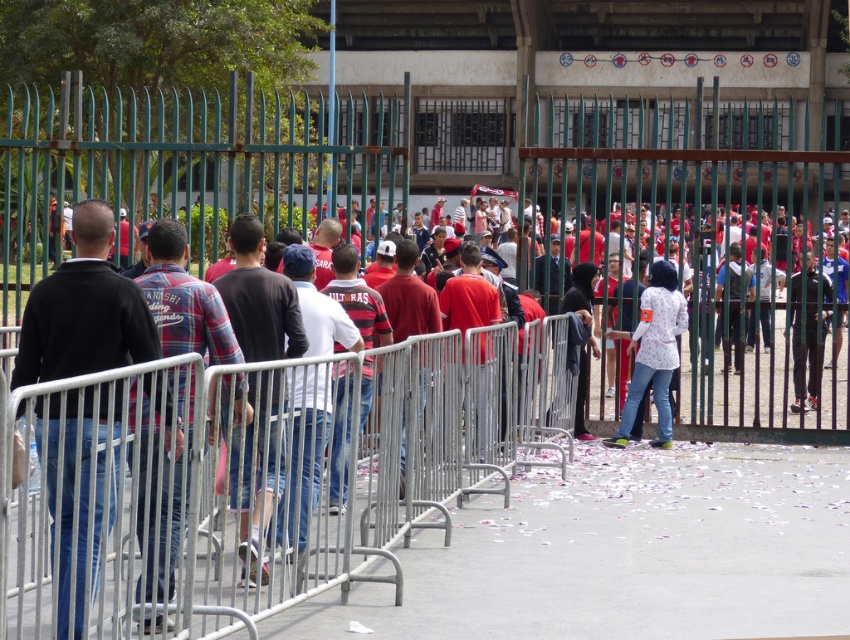
Does silver metallic rail at center have a greater width compared to black sweater at left?

Yes.

Between silver metallic rail at center and black sweater at left, which one is positioned higher?

black sweater at left is above.

Does point (217, 461) lie behind point (88, 204)?

Yes, point (217, 461) is farther from viewer.

Where is `silver metallic rail at center`? silver metallic rail at center is located at coordinates (344, 472).

Who is positioned more to the left, matte black jacket at center or white matte shirt at center?

From the viewer's perspective, matte black jacket at center appears more on the left side.

Does matte black jacket at center lie in front of white matte shirt at center?

Yes.

Locate an element on the screen. matte black jacket at center is located at coordinates (258, 464).

Is matte black jacket at center taller than plaid shirt at center?

Yes, matte black jacket at center is taller than plaid shirt at center.

Between point (299, 449) and point (144, 458), which one is positioned behind?

Positioned behind is point (299, 449).

The image size is (850, 640). What do you see at coordinates (258, 464) in the screenshot? I see `matte black jacket at center` at bounding box center [258, 464].

The height and width of the screenshot is (640, 850). I want to click on matte black jacket at center, so click(258, 464).